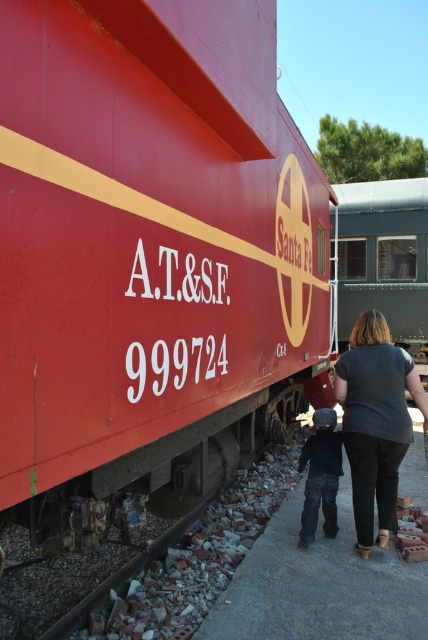
Is green matte train car at center positioned in front of dark gray knit sweater at center?

No, green matte train car at center is behind dark gray knit sweater at center.

Can you confirm if green matte train car at center is taller than dark gray knit sweater at center?

Indeed, green matte train car at center has a greater height compared to dark gray knit sweater at center.

Where is `green matte train car at center`? This screenshot has height=640, width=428. green matte train car at center is located at coordinates (383, 256).

From the picture: Does dark gray knit sweater at center lie behind dark gray sweater at lower center?

No.

Does dark gray knit sweater at center have a larger size compared to dark gray sweater at lower center?

Indeed, dark gray knit sweater at center has a larger size compared to dark gray sweater at lower center.

Is point (404, 442) more distant than point (326, 524)?

No, it is in front of (326, 524).

Locate an element on the screen. The width and height of the screenshot is (428, 640). dark gray knit sweater at center is located at coordinates (376, 420).

Is green matte train car at center smaller than dark gray sweater at lower center?

No.

Who is more distant from viewer, (344, 198) or (311, 449)?

Positioned behind is point (344, 198).

Locate an element on the screen. This screenshot has height=640, width=428. green matte train car at center is located at coordinates [x=383, y=256].